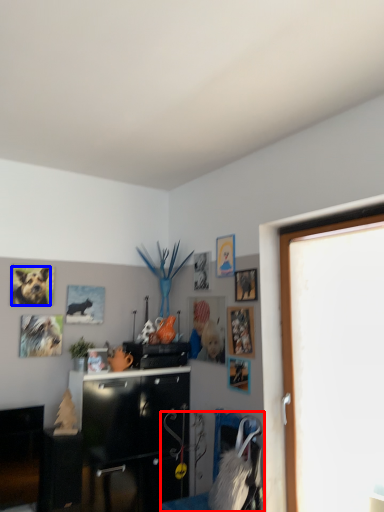
Question: Among these objects, which one is nearest to the camera, swivel chair (highlighted by a red box) or animal (highlighted by a blue box)?

Choices:
 (A) swivel chair
 (B) animal

Answer: (A)